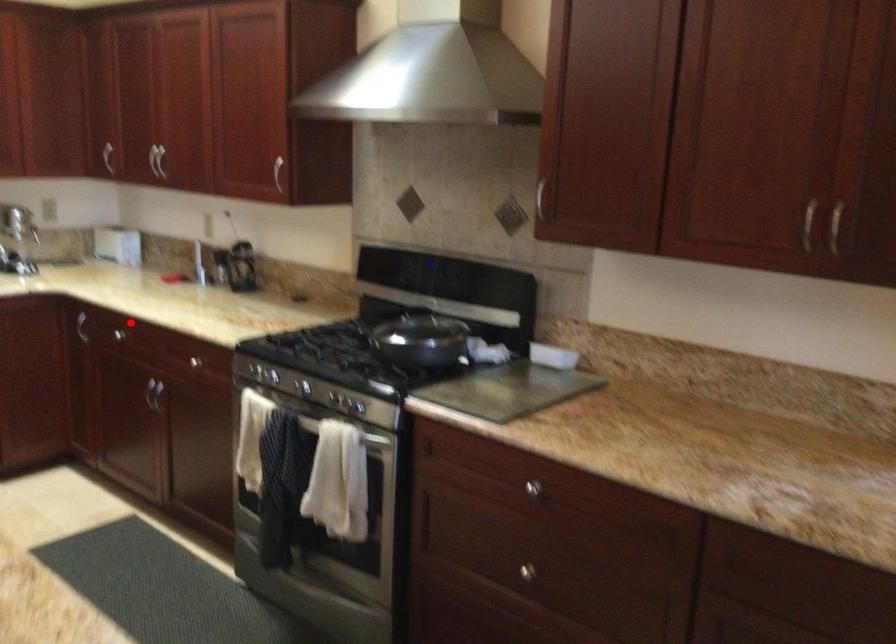
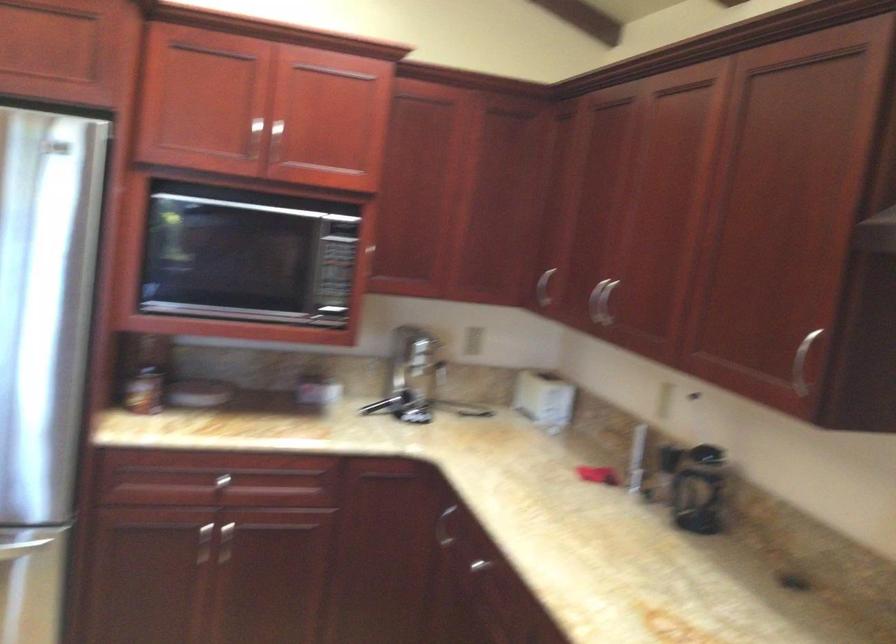
In the second image, find the point that corresponds to the highlighted location in the first image.

(495, 567)